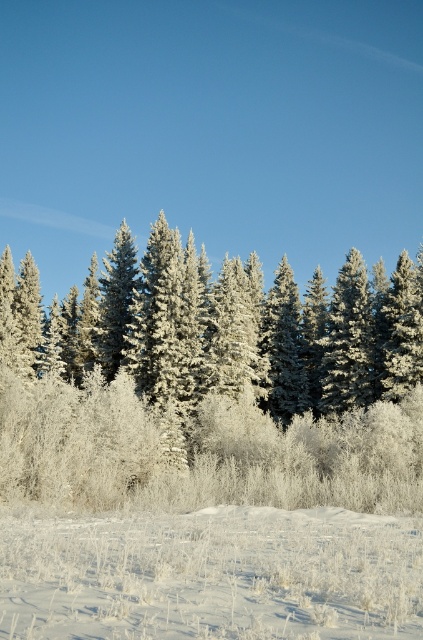
You are a photographer standing in the winter landscape scene. You want to take a photo that includes both the frosted pine trees at center and the white frosty grass at lower center. Which object should be closer to the camera to ensure both are in focus?

The frosted pine trees at center should be closer to the camera because the white frosty grass at lower center is behind them, so focusing on the frosted pine trees at center will keep both objects in focus.

You are standing in the winter landscape and want to take a photo of the frosted pine trees at center and the white frosty grass at lower center. Which object will appear larger in the photo?

The frosted pine trees at center will appear larger in the photo because they are taller than the white frosty grass at lower center.

You are standing at the point marked by point (206, 384) in the winter forest scene. What do you see directly in front of you?

You see frosted pine trees at center directly in front of you, as point (206, 384) marks their location.